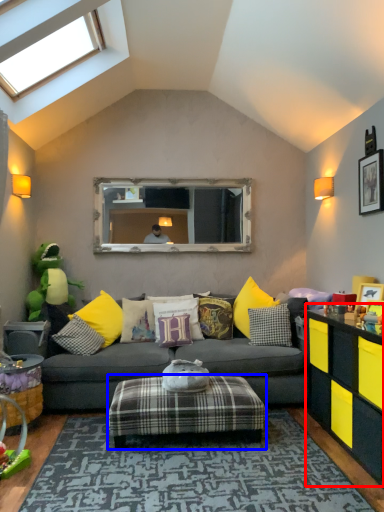
Question: Which object is further to the camera taking this photo, cabinetry (highlighted by a red box) or stool (highlighted by a blue box)?

Choices:
 (A) cabinetry
 (B) stool

Answer: (B)